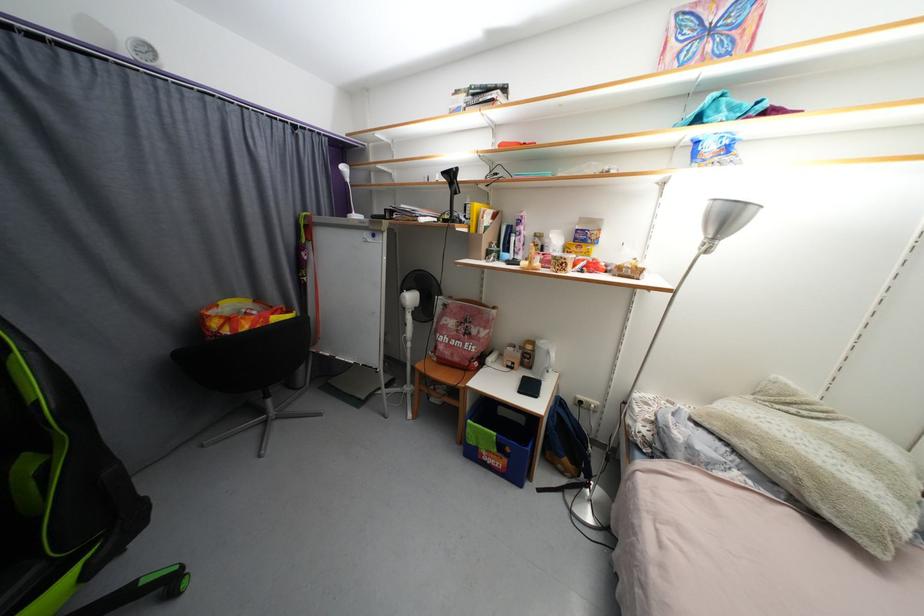
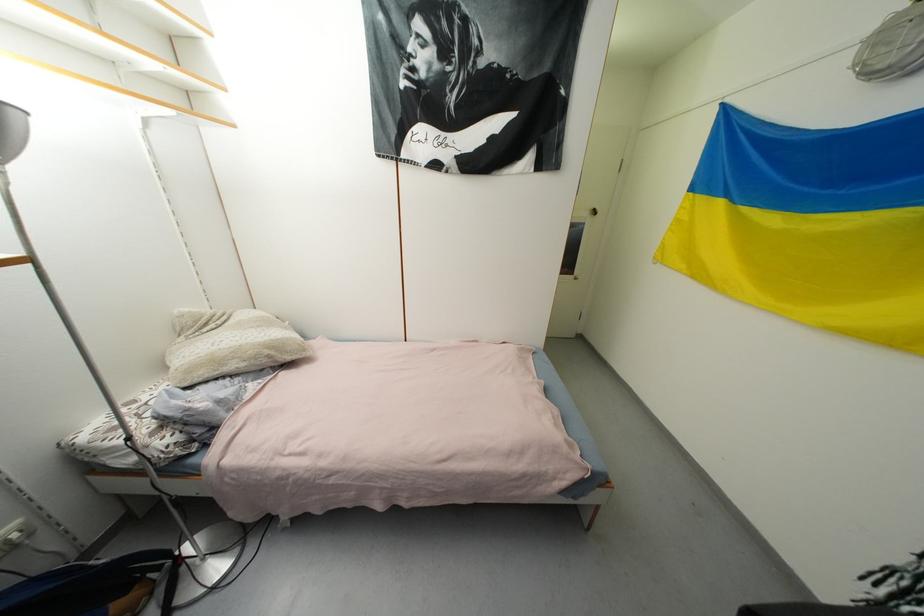
Find the pixel in the second image that matches the point at 785,466 in the first image.

(261, 359)